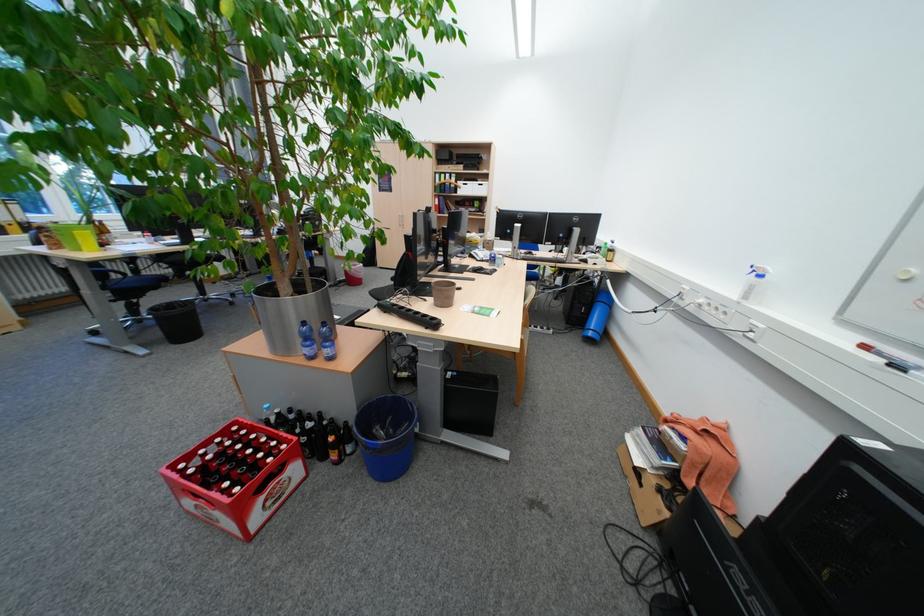
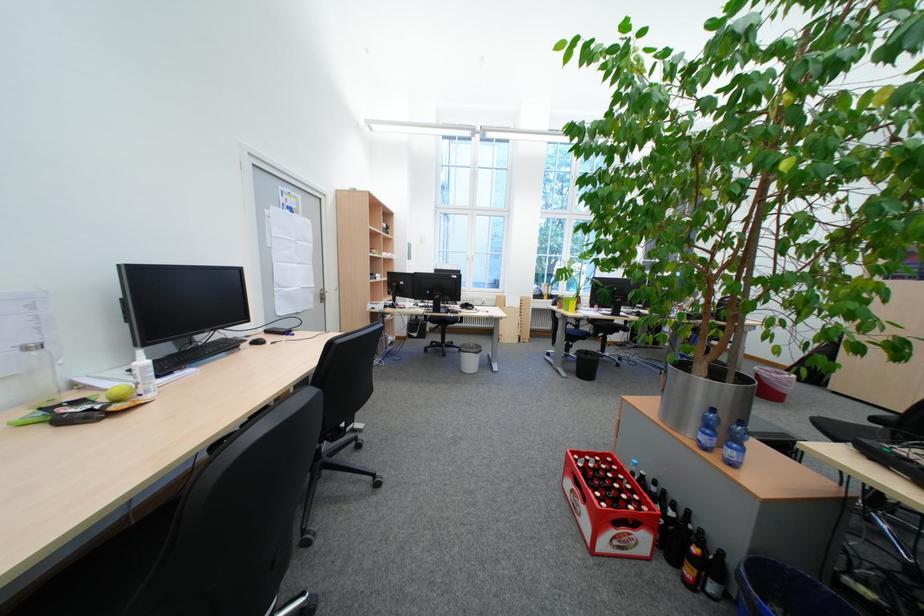
The point at (405,280) is marked in the first image. Where is the corresponding point in the second image?

(886, 421)